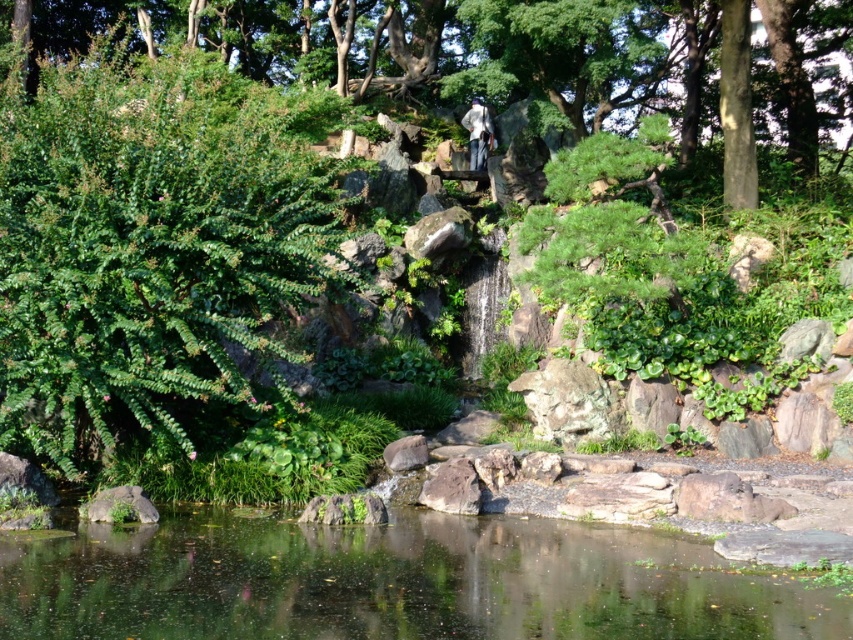
Question: Can you confirm if green leafy tree at upper center is positioned to the left of white fabric at center?

Choices:
 (A) no
 (B) yes

Answer: (B)

Question: Is green leafy tree at upper center wider than white fabric at center?

Choices:
 (A) yes
 (B) no

Answer: (A)

Question: Considering the real-world distances, which object is closest to the transparent water at center?

Choices:
 (A) green leafy tree at upper center
 (B) white fabric at center

Answer: (A)

Question: Which point is closer to the camera?

Choices:
 (A) (477, 141)
 (B) (302, 554)

Answer: (B)

Question: Can you confirm if green leafy tree at upper center is positioned below white fabric at center?

Choices:
 (A) yes
 (B) no

Answer: (B)

Question: Which point is closer to the camera?

Choices:
 (A) (474, 136)
 (B) (430, 28)
 (C) (314, 586)

Answer: (C)